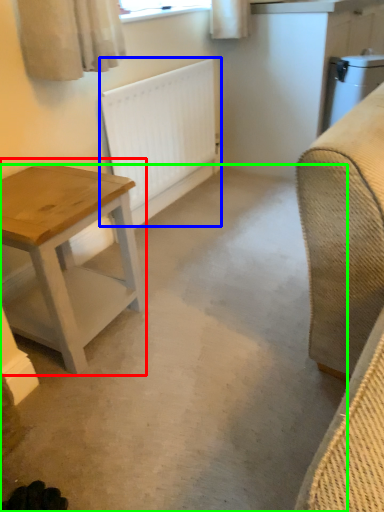
Question: Considering the real-world distances, which object is farthest from table (highlighted by a red box)? radiator (highlighted by a blue box) or concrete (highlighted by a green box)?

Choices:
 (A) radiator
 (B) concrete

Answer: (A)